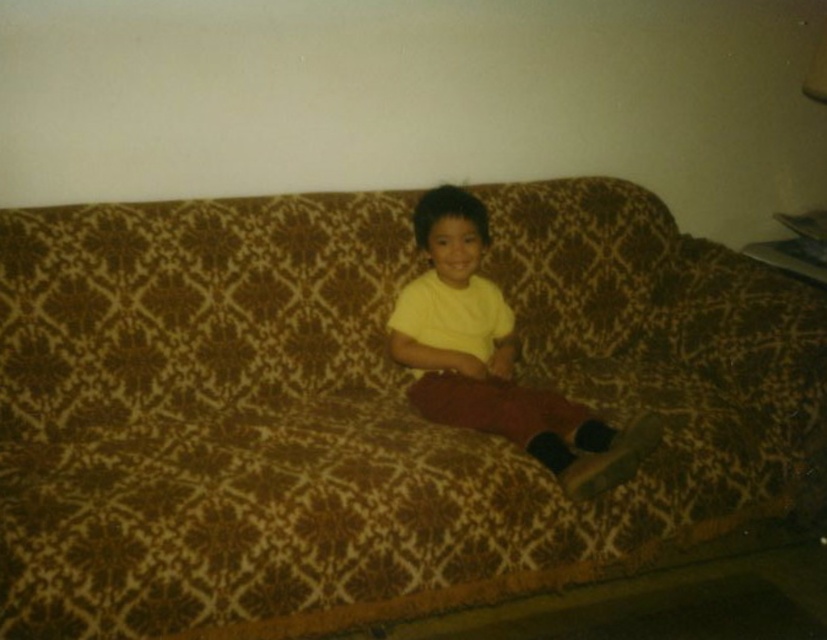
Question: Does brown textured couch at center have a smaller size compared to yellow matte shirt at center?

Choices:
 (A) no
 (B) yes

Answer: (A)

Question: Which of the following is the closest to the observer?

Choices:
 (A) yellow matte shirt at center
 (B) brown textured couch at center

Answer: (B)

Question: Is brown textured couch at center further to camera compared to yellow matte shirt at center?

Choices:
 (A) no
 (B) yes

Answer: (A)

Question: Which point appears closest to the camera in this image?

Choices:
 (A) coord(96,554)
 (B) coord(557,412)

Answer: (A)

Question: Can you confirm if brown textured couch at center is wider than yellow matte shirt at center?

Choices:
 (A) no
 (B) yes

Answer: (B)